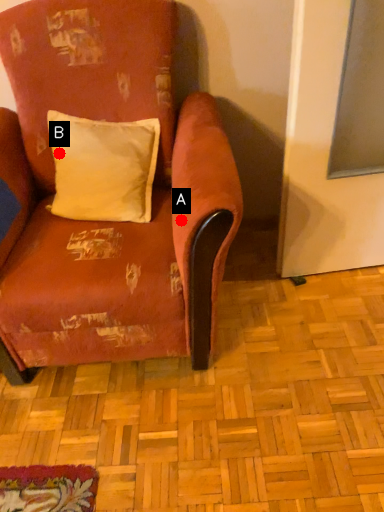
Question: Two points are circled on the image, labeled by A and B beside each circle. Among these points, which one is farthest from the camera?

Choices:
 (A) A is further
 (B) B is further

Answer: (B)